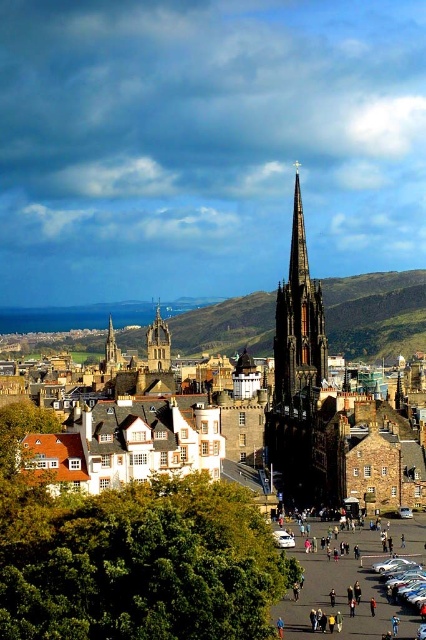
You are standing in the public space in front of the cathedral and want to take a photo of both the dark brown stone spire at center and the golden stone spire at center. Which spire should you position to your left to include both in the frame?

You should position the golden stone spire at center to your left since the dark brown stone spire at center is to the right of it, allowing both to be captured in the photo.

You are an architect examining the Edinburgh skyline. You notice two spires in the image, the dark brown stone spire at center and the golden stone spire at center. Which spire appears higher in the image?

The dark brown stone spire at center is located above the golden stone spire at center, so it appears higher in the image.

You are standing in front of St. Giles Cathedral in Edinburgh and want to walk to a specific location. You see two points marked on the ground in front of you. The first point is at coordinate point(287,285) and the second is at point(157,362). Which point is closer to you?

Point(287,285) is in front of point(157,362), so the first point is closer to you.